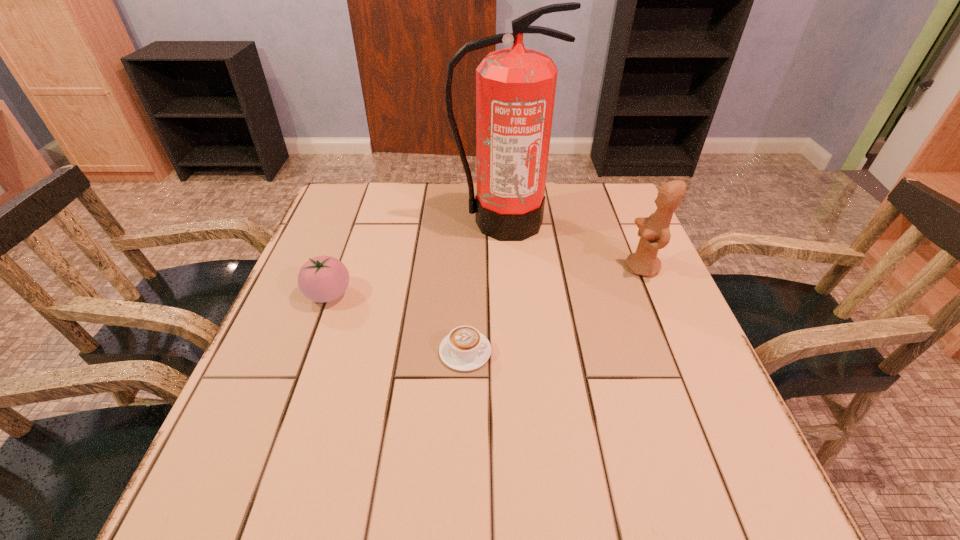
The height and width of the screenshot is (540, 960). Identify the location of vacant position located on the front-facing side of the second tallest object. (540, 267).

The height and width of the screenshot is (540, 960). Find the location of `free location located 0.370m on the front-facing side of the second tallest object`. free location located 0.370m on the front-facing side of the second tallest object is located at coordinates (474, 267).

You are a GUI agent. You are given a task and a screenshot of the screen. Output one action in this format:
    pyautogui.click(x=<x>, y=<y>)
    Task: Click on the free space located 0.300m on the back of the tomato
    The width and height of the screenshot is (960, 540).
    Given the screenshot: What is the action you would take?
    pyautogui.click(x=360, y=208)

Where is `free space located with the handle on the right side of the shortest object`? The image size is (960, 540). free space located with the handle on the right side of the shortest object is located at coordinates (521, 352).

Find the location of a particular element. object that is at the far edge is located at coordinates (515, 87).

Where is `object that is at the left edge`? object that is at the left edge is located at coordinates (321, 279).

Find the location of a particular element. This screenshot has height=540, width=960. object at the right edge is located at coordinates (654, 232).

In the image, there is a desktop. Identify the location of free space at the far edge. (432, 200).

Locate an element on the screen. The width and height of the screenshot is (960, 540). vacant area at the near edge of the desktop is located at coordinates (504, 521).

At what (x,y) coordinates should I click in order to perform the action: click on blank space at the left edge of the desktop. Please return your answer as a coordinate pair (x, y). Looking at the image, I should click on (289, 438).